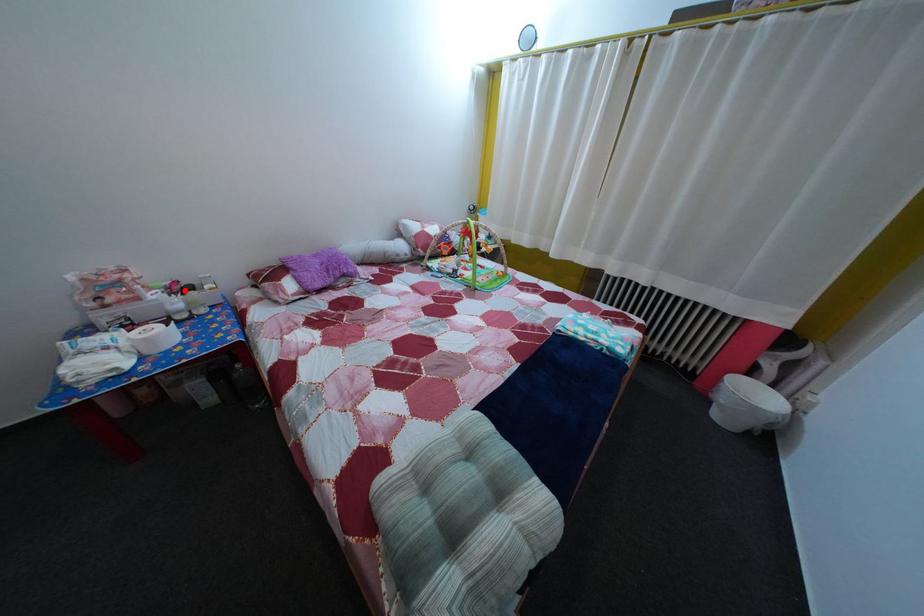
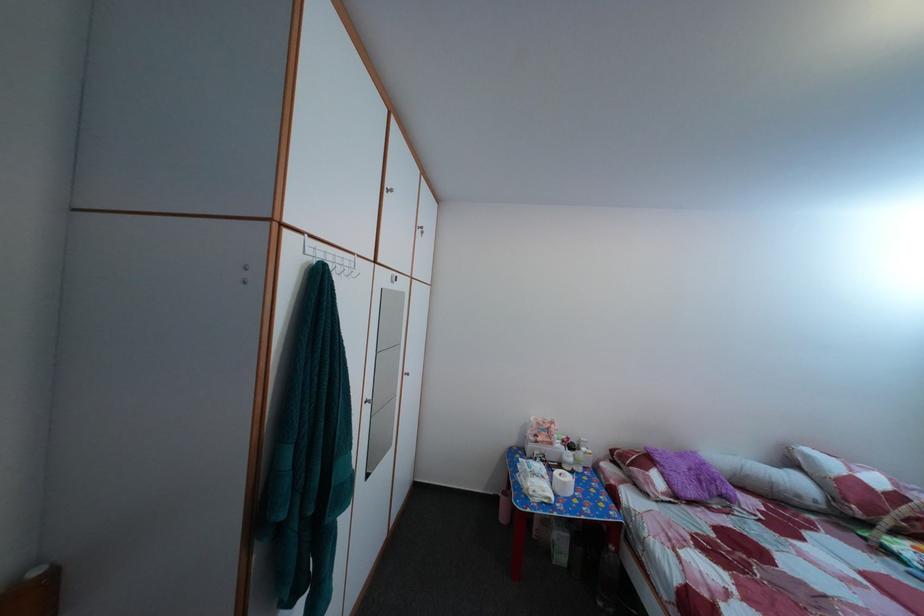
Locate, in the second image, the point that corresponds to the highlighted location in the first image.

(578, 447)